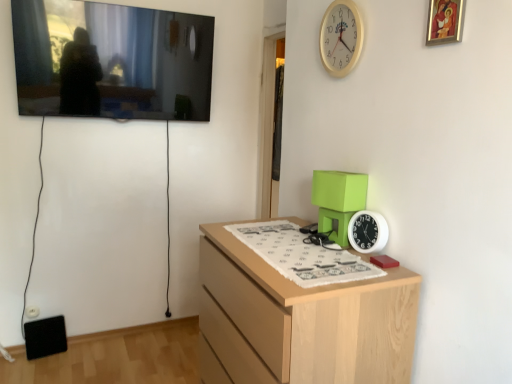
Question: Does light wood chest of drawers at center turn towards white plastic clock at right, which is counted as the 1th clock, starting from the bottom?

Choices:
 (A) no
 (B) yes

Answer: (A)

Question: Is light wood chest of drawers at center further to the viewer compared to white plastic clock at right, the 2th clock viewed from the top?

Choices:
 (A) no
 (B) yes

Answer: (A)

Question: Does light wood chest of drawers at center have a lesser height compared to white plastic clock at right, the 2th clock viewed from the top?

Choices:
 (A) yes
 (B) no

Answer: (B)

Question: Considering the relative sizes of light wood chest of drawers at center and white plastic clock at right, which is counted as the 1th clock, starting from the bottom, in the image provided, is light wood chest of drawers at center smaller than white plastic clock at right, which is counted as the 1th clock, starting from the bottom,?

Choices:
 (A) no
 (B) yes

Answer: (A)

Question: Is light wood chest of drawers at center wider than white plastic clock at right, which is counted as the 1th clock, starting from the bottom?

Choices:
 (A) yes
 (B) no

Answer: (A)

Question: From a real-world perspective, is flat screen tv at upper left, placed as the second picture frame when sorted from front to back, positioned above or below gold-framed painting at upper right, arranged as the first picture frame when viewed from the right?

Choices:
 (A) above
 (B) below

Answer: (B)

Question: Considering the positions of flat screen tv at upper left, which appears as the 2th picture frame when viewed from the right, and gold-framed painting at upper right, arranged as the first picture frame when viewed from the right, in the image, is flat screen tv at upper left, which appears as the 2th picture frame when viewed from the right, wider or thinner than gold-framed painting at upper right, arranged as the first picture frame when viewed from the right,?

Choices:
 (A) thin
 (B) wide

Answer: (B)

Question: Is flat screen tv at upper left, the first picture frame from the back, spatially inside gold-framed painting at upper right, which is counted as the 1th picture frame, starting from the front, or outside of it?

Choices:
 (A) inside
 (B) outside

Answer: (B)

Question: From the image's perspective, relative to gold-framed painting at upper right, which is counted as the 1th picture frame, starting from the front, is flat screen tv at upper left, placed as the first picture frame when sorted from left to right, above or below?

Choices:
 (A) below
 (B) above

Answer: (B)

Question: From a real-world perspective, is white plastic clock at upper right, the 1th clock viewed from the top, positioned above or below white plastic clock at right, the 2th clock viewed from the top?

Choices:
 (A) below
 (B) above

Answer: (B)

Question: Is white plastic clock at upper right, placed as the second clock when sorted from bottom to top, to the left or to the right of white plastic clock at right, the 2th clock viewed from the top, in the image?

Choices:
 (A) left
 (B) right

Answer: (A)

Question: In terms of height, does white plastic clock at upper right, placed as the second clock when sorted from bottom to top, look taller or shorter compared to white plastic clock at right, the 2th clock viewed from the top?

Choices:
 (A) tall
 (B) short

Answer: (A)

Question: Considering the positions of white plastic clock at upper right, the 1th clock viewed from the top, and white plastic clock at right, which is counted as the 1th clock, starting from the bottom, in the image, is white plastic clock at upper right, the 1th clock viewed from the top, wider or thinner than white plastic clock at right, which is counted as the 1th clock, starting from the bottom,?

Choices:
 (A) thin
 (B) wide

Answer: (A)

Question: From a real-world perspective, is white plastic clock at upper right, placed as the second clock when sorted from bottom to top, above or below light wood chest of drawers at center?

Choices:
 (A) above
 (B) below

Answer: (A)

Question: Is white plastic clock at upper right, placed as the second clock when sorted from bottom to top, situated inside light wood chest of drawers at center or outside?

Choices:
 (A) outside
 (B) inside

Answer: (A)